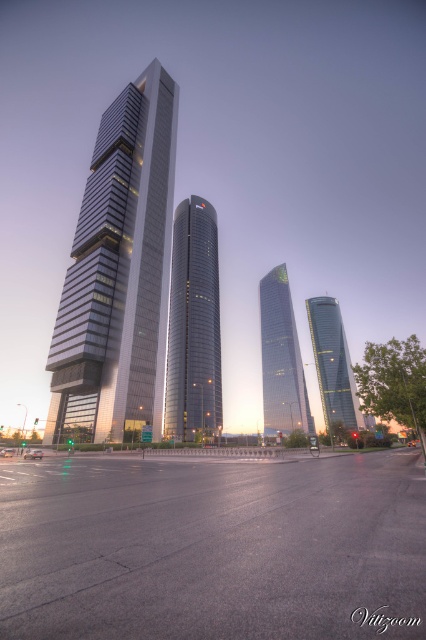
Is metallic glass skyscraper at left further to the viewer compared to green glass skyscraper at center?

No.

Can you confirm if metallic glass skyscraper at left is positioned to the right of green glass skyscraper at center?

No, metallic glass skyscraper at left is not to the right of green glass skyscraper at center.

Is point (126, 387) farther from camera compared to point (290, 432)?

No, it is in front of (290, 432).

This screenshot has height=640, width=426. I want to click on metallic glass skyscraper at left, so click(x=118, y=275).

Is metallic glass skyscraper at left thinner than glassy reflective skyscraper at right?

Yes, metallic glass skyscraper at left is thinner than glassy reflective skyscraper at right.

Is point (172, 129) farther from viewer compared to point (327, 344)?

No, it is in front of (327, 344).

The image size is (426, 640). What are the coordinates of `metallic glass skyscraper at left` in the screenshot? It's located at (118, 275).

Is metallic glass skyscraper at left above shiny glass skyscraper at center?

Indeed, metallic glass skyscraper at left is positioned over shiny glass skyscraper at center.

Does point (94, 328) come behind point (198, 301)?

No, it is in front of (198, 301).

The height and width of the screenshot is (640, 426). Find the location of `metallic glass skyscraper at left`. metallic glass skyscraper at left is located at coordinates (118, 275).